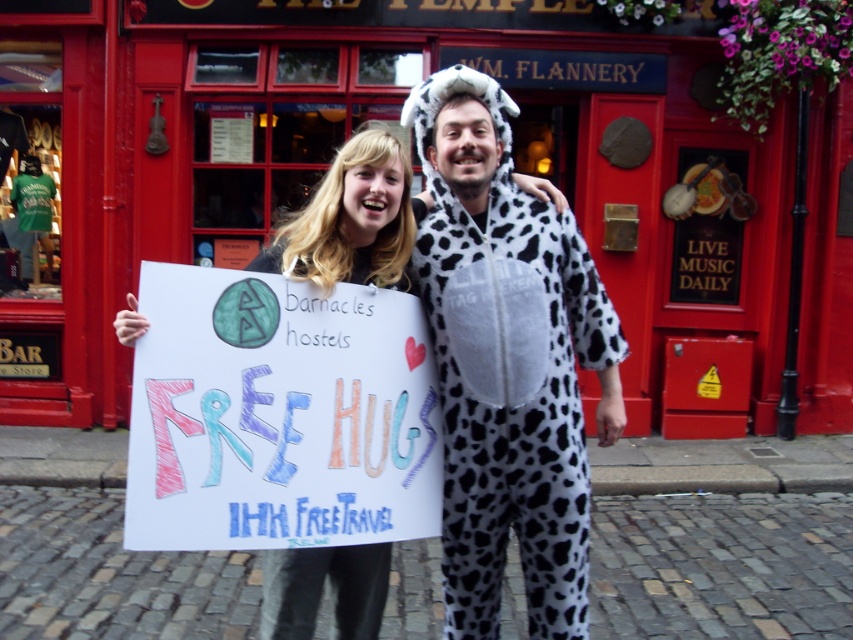
Question: Does spotted fleece onesie at center have a smaller size compared to white-spotted fabric costume at center?

Choices:
 (A) no
 (B) yes

Answer: (A)

Question: Which object is closer to the camera taking this photo?

Choices:
 (A) white-spotted costume at center
 (B) white-spotted fabric costume at center

Answer: (B)

Question: Can you confirm if white-spotted costume at center is wider than spotted fleece onesie at center?

Choices:
 (A) no
 (B) yes

Answer: (B)

Question: Which is nearer to the white-spotted fabric costume at center?

Choices:
 (A) white-spotted costume at center
 (B) spotted fleece onesie at center

Answer: (B)

Question: Can you confirm if spotted fleece onesie at center is wider than white-spotted fabric costume at center?

Choices:
 (A) no
 (B) yes

Answer: (B)

Question: Which point is closer to the camera?

Choices:
 (A) spotted fleece onesie at center
 (B) white-spotted costume at center

Answer: (B)